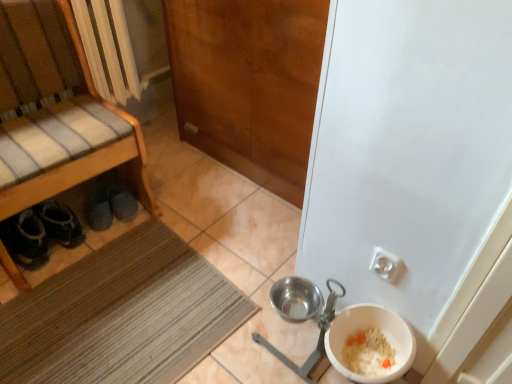
Locate an element on the screen. The height and width of the screenshot is (384, 512). vacant space situated on the left part of wooden door at center is located at coordinates (185, 174).